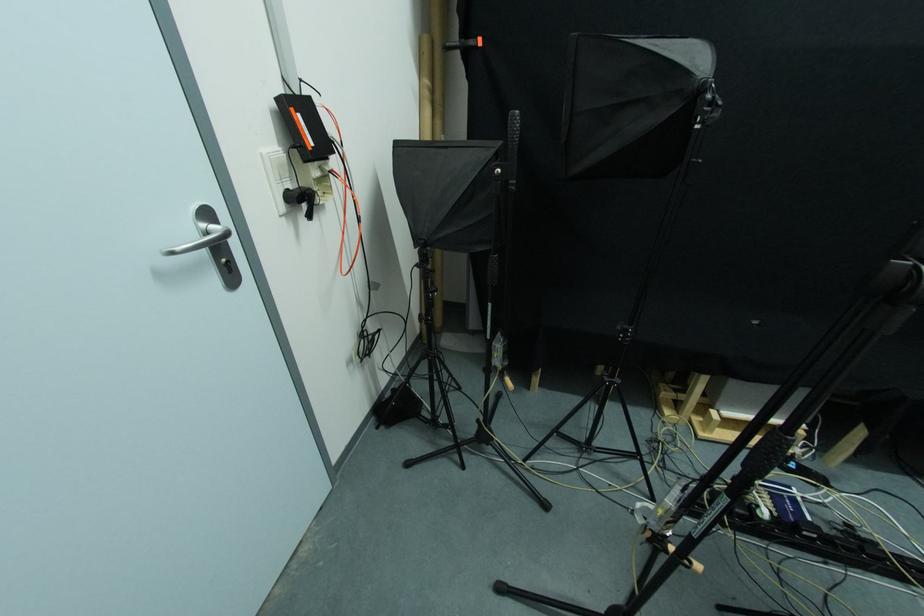
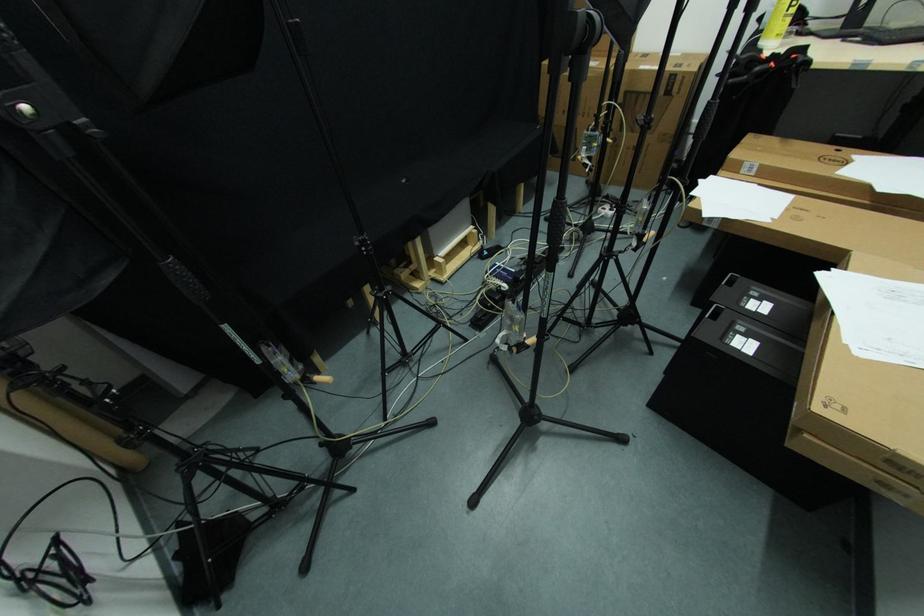
The point at (784, 580) is marked in the first image. Where is the corresponding point in the second image?

(535, 310)